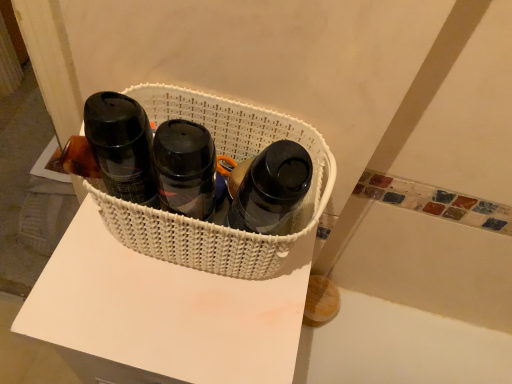
Find the location of a particular element. free spot in front of matte black bottle at center, placed as the second bottle when sorted from left to right is located at coordinates (218, 341).